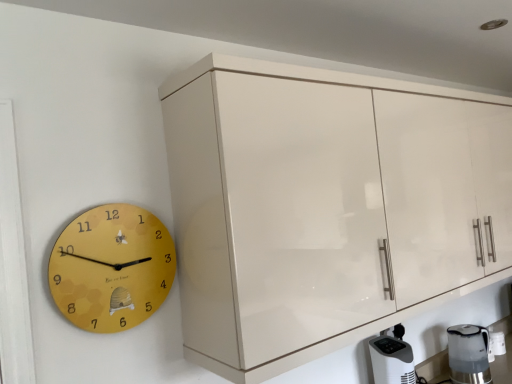
The height and width of the screenshot is (384, 512). What are the coordinates of `yellow matte clock at left` in the screenshot? It's located at (112, 268).

In order to face satin silver kettle at lower right, should I rotate leftwards or rightwards?

You should look right and rotate roughly 26.288 degrees.

This screenshot has height=384, width=512. Describe the element at coordinates (326, 206) in the screenshot. I see `glossy cream cabinet at upper right` at that location.

This screenshot has width=512, height=384. Find the location of `yellow matte clock at left`. yellow matte clock at left is located at coordinates (112, 268).

From the picture: How far apart are white plastic air purifier at lower right and yellow matte clock at left?

They are 1.04 meters apart.

Considering the positions of point (395, 346) and point (161, 227), is point (395, 346) closer or farther from the camera than point (161, 227)?

Point (395, 346) is farther from the camera than point (161, 227).

Is white plastic air purifier at lower right looking in the opposite direction of yellow matte clock at left?

No.

What's the angular difference between white plastic air purifier at lower right and yellow matte clock at left's facing directions?

white plastic air purifier at lower right and yellow matte clock at left are facing 3.67 degrees away from each other.

Is glossy cream cabinet at upper right not near yellow matte clock at left?

No, glossy cream cabinet at upper right is not far from yellow matte clock at left.

Is glossy cream cabinet at upper right bigger than yellow matte clock at left?

Correct, glossy cream cabinet at upper right is larger in size than yellow matte clock at left.

Could you tell me if glossy cream cabinet at upper right is facing yellow matte clock at left?

No, glossy cream cabinet at upper right is not facing towards yellow matte clock at left.

Between glossy cream cabinet at upper right and yellow matte clock at left, which one appears on the right side from the viewer's perspective?

glossy cream cabinet at upper right is more to the right.

Is satin silver kettle at lower right facing away from yellow matte clock at left?

No, satin silver kettle at lower right is not facing away from yellow matte clock at left.

This screenshot has width=512, height=384. Identify the location of wall clock lying on the left of satin silver kettle at lower right. (112, 268).

Considering the positions of points (441, 353) and (146, 213), is point (441, 353) closer to camera compared to point (146, 213)?

That is False.

Is satin silver kettle at lower right taller or shorter than yellow matte clock at left?

Considering their sizes, satin silver kettle at lower right has less height than yellow matte clock at left.

Would you consider yellow matte clock at left to be distant from glossy cream cabinet at upper right?

yellow matte clock at left is near glossy cream cabinet at upper right, not far away.

Is the depth of yellow matte clock at left less than that of glossy cream cabinet at upper right?

No, the depth of yellow matte clock at left is greater than that of glossy cream cabinet at upper right.

The image size is (512, 384). Identify the location of cabinetry on the right of yellow matte clock at left. (326, 206).

Which point is more forward, (87, 266) or (248, 189)?

The point (248, 189) is more forward.

Considering their positions, is satin silver kettle at lower right located in front of or behind glossy cream cabinet at upper right?

satin silver kettle at lower right is behind glossy cream cabinet at upper right.

Between point (446, 362) and point (446, 245), which one is positioned behind?

The point (446, 362) is more distant.

Which of these two, satin silver kettle at lower right or glossy cream cabinet at upper right, is bigger?

Bigger between the two is glossy cream cabinet at upper right.

Is glossy cream cabinet at upper right spatially inside white plastic air purifier at lower right, or outside of it?

glossy cream cabinet at upper right is spatially situated outside white plastic air purifier at lower right.

Looking at this image, would you consider glossy cream cabinet at upper right to be distant from white plastic air purifier at lower right?

No, glossy cream cabinet at upper right is in close proximity to white plastic air purifier at lower right.

Does point (277, 153) come behind point (393, 343)?

No.

From the image's perspective, which is below, glossy cream cabinet at upper right or white plastic air purifier at lower right?

From the image's view, white plastic air purifier at lower right is below.

Is glossy cream cabinet at upper right wider or thinner than satin silver kettle at lower right?

Clearly, glossy cream cabinet at upper right has more width compared to satin silver kettle at lower right.

Is glossy cream cabinet at upper right positioned far away from satin silver kettle at lower right?

No, glossy cream cabinet at upper right is in close proximity to satin silver kettle at lower right.

Considering the relative sizes of glossy cream cabinet at upper right and satin silver kettle at lower right in the image provided, is glossy cream cabinet at upper right smaller than satin silver kettle at lower right?

No.

Which object is positioned more to the right, glossy cream cabinet at upper right or satin silver kettle at lower right?

satin silver kettle at lower right.

The image size is (512, 384). What are the coordinates of `appliance below the yellow matte clock at left (from a real-world perspective)` in the screenshot? It's located at (392, 360).

Locate an element on the screen. wall clock on the left side of glossy cream cabinet at upper right is located at coordinates (112, 268).

When comparing their distances from white plastic air purifier at lower right, does satin silver kettle at lower right or yellow matte clock at left seem further?

Based on the image, yellow matte clock at left appears to be further to white plastic air purifier at lower right.

Which object lies further to the anchor point white plastic air purifier at lower right, glossy cream cabinet at upper right or yellow matte clock at left?

Among the two, yellow matte clock at left is located further to white plastic air purifier at lower right.

Considering their positions, is yellow matte clock at left positioned closer to glossy cream cabinet at upper right than white plastic air purifier at lower right?

The object closer to glossy cream cabinet at upper right is yellow matte clock at left.

Estimate the real-world distances between objects in this image. Which object is further from white plastic air purifier at lower right, satin silver kettle at lower right or glossy cream cabinet at upper right?

Among the two, glossy cream cabinet at upper right is located further to white plastic air purifier at lower right.

When comparing their distances from glossy cream cabinet at upper right, does white plastic air purifier at lower right or yellow matte clock at left seem closer?

Among the two, yellow matte clock at left is located nearer to glossy cream cabinet at upper right.

Looking at the image, which one is located further to yellow matte clock at left, glossy cream cabinet at upper right or white plastic air purifier at lower right?

Based on the image, white plastic air purifier at lower right appears to be further to yellow matte clock at left.

Based on their spatial positions, is white plastic air purifier at lower right or yellow matte clock at left further from satin silver kettle at lower right?

The object further to satin silver kettle at lower right is yellow matte clock at left.

Which object lies nearer to the anchor point yellow matte clock at left, white plastic air purifier at lower right or satin silver kettle at lower right?

The object closer to yellow matte clock at left is white plastic air purifier at lower right.

You are a GUI agent. You are given a task and a screenshot of the screen. Output one action in this format:
    pyautogui.click(x=<x>, y=<y>)
    Task: Click on the counter top between glossy cream cabinet at upper right and white plastic air purifier at lower right in the up-down direction
    The height and width of the screenshot is (384, 512).
    Given the screenshot: What is the action you would take?
    pyautogui.click(x=433, y=365)

At what (x,y) coordinates should I click in order to perform the action: click on appliance between yellow matte clock at left and glossy cream cabinet at upper right from left to right. Please return your answer as a coordinate pair (x, y). Looking at the image, I should click on (392, 360).

Find the location of `cabinetry located between yellow matte clock at left and satin silver kettle at lower right in the left-right direction`. cabinetry located between yellow matte clock at left and satin silver kettle at lower right in the left-right direction is located at coordinates (326, 206).

This screenshot has width=512, height=384. Find the location of `appliance between yellow matte clock at left and satin silver kettle at lower right from left to right`. appliance between yellow matte clock at left and satin silver kettle at lower right from left to right is located at coordinates (392, 360).